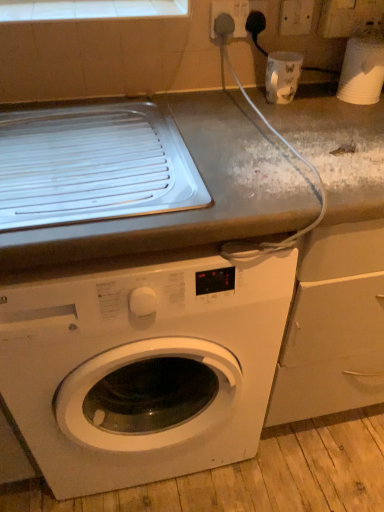
Find the location of a particular element. The image size is (384, 512). free space above white glossy washing machine at center (from a real-world perspective) is located at coordinates (154, 181).